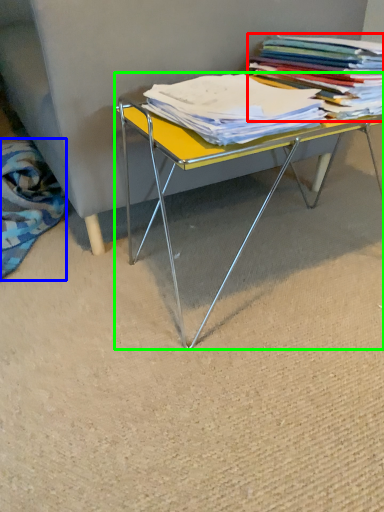
Question: Which object is positioned farthest from book (highlighted by a red box)? Select from fabric (highlighted by a blue box) and table (highlighted by a green box).

Choices:
 (A) fabric
 (B) table

Answer: (A)